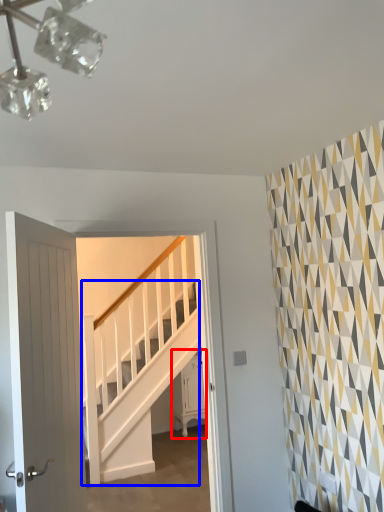
Question: Among these objects, which one is farthest to the camera, furniture (highlighted by a red box) or stairs (highlighted by a blue box)?

Choices:
 (A) furniture
 (B) stairs

Answer: (A)